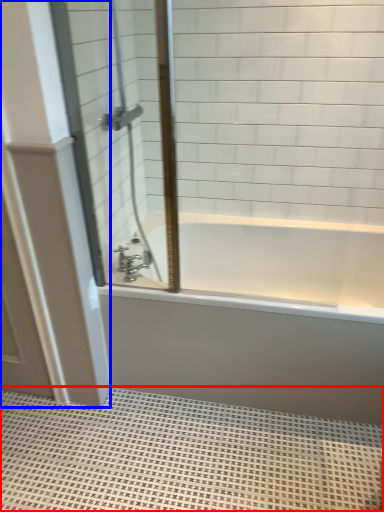
Question: Which object appears closest to the camera in this image, bath mat (highlighted by a red box) or door (highlighted by a blue box)?

Choices:
 (A) bath mat
 (B) door

Answer: (A)